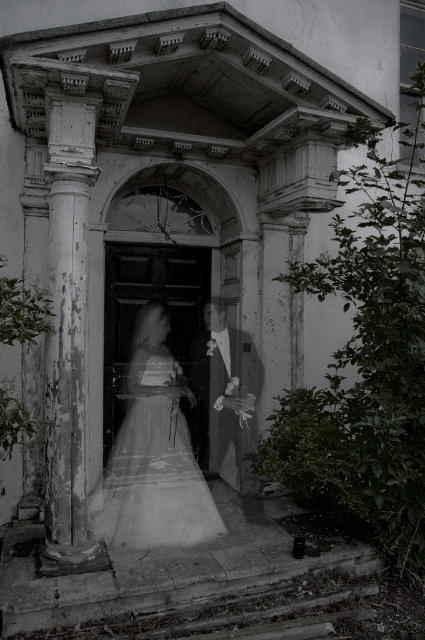
You are a photographer trying to capture a photo of the smooth white suit at center and the weathered stone column at left. Which object should you focus on first if you want to include both in your shot without moving the camera?

You should focus on the weathered stone column at left first because it is closer to the camera than the smooth white suit at center, allowing both to be in the frame without moving the camera.